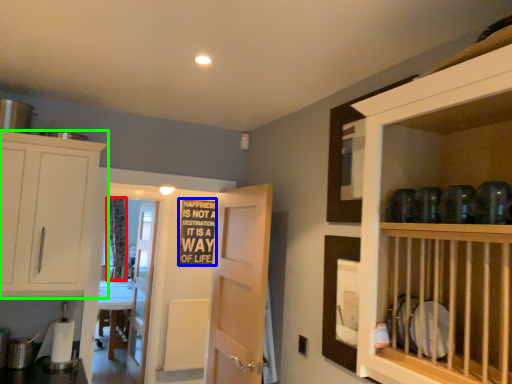
Question: Estimate the real-world distances between objects in this image. Which object is closer to curtain (highlighted by a red box), writing (highlighted by a blue box) or cabinetry (highlighted by a green box)?

Choices:
 (A) writing
 (B) cabinetry

Answer: (A)